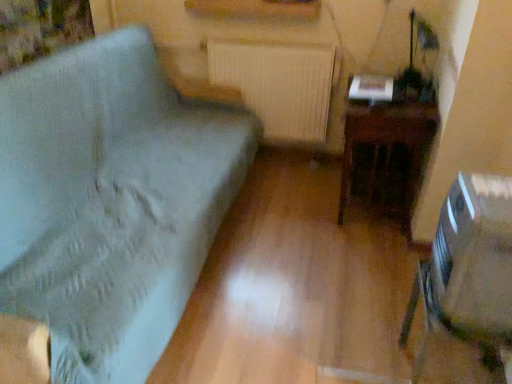
Identify the location of clear plastic swivel chair at lower right. (468, 269).

In order to face light blue fabric cushion at left, should I rotate leftwards or rightwards?

You should rotate left by 16.613 degrees.

Image resolution: width=512 pixels, height=384 pixels. Describe the element at coordinates (278, 84) in the screenshot. I see `white textured radiator at center` at that location.

You are a GUI agent. You are given a task and a screenshot of the screen. Output one action in this format:
    pyautogui.click(x=<x>, y=<y>)
    Task: Click on the clear plastic swivel chair at lower right
    
    Given the screenshot: What is the action you would take?
    pyautogui.click(x=468, y=269)

How distant is clear plastic swivel chair at lower right from light blue fabric cushion at left?

clear plastic swivel chair at lower right is 1.17 meters away from light blue fabric cushion at left.

From a real-world perspective, which is physically below, clear plastic swivel chair at lower right or light blue fabric cushion at left?

light blue fabric cushion at left, from a real-world perspective.

Is clear plastic swivel chair at lower right aimed at light blue fabric cushion at left?

Yes, clear plastic swivel chair at lower right is facing light blue fabric cushion at left.

Would you consider clear plastic swivel chair at lower right to be distant from light blue fabric cushion at left?

clear plastic swivel chair at lower right is far away from light blue fabric cushion at left.

Is white textured radiator at center positioned beyond the bounds of clear plastic swivel chair at lower right?

white textured radiator at center lies outside clear plastic swivel chair at lower right's area.

Is white textured radiator at center turned away from clear plastic swivel chair at lower right?

No, clear plastic swivel chair at lower right is not at the back of white textured radiator at center.

Where is `radiator below the clear plastic swivel chair at lower right (from a real-world perspective)`? The height and width of the screenshot is (384, 512). radiator below the clear plastic swivel chair at lower right (from a real-world perspective) is located at coordinates (278, 84).

Considering their positions, is white textured radiator at center located in front of or behind clear plastic swivel chair at lower right?

white textured radiator at center is behind clear plastic swivel chair at lower right.

Is white textured radiator at center not close to light blue fabric cushion at left?

No, white textured radiator at center is in close proximity to light blue fabric cushion at left.

Is white textured radiator at center not within light blue fabric cushion at left?

That's correct, white textured radiator at center is outside of light blue fabric cushion at left.

Looking at this image, from a real-world perspective, is white textured radiator at center located beneath light blue fabric cushion at left?

Actually, white textured radiator at center is physically above light blue fabric cushion at left in the real world.

Is white textured radiator at center positioned with its back to light blue fabric cushion at left?

No, white textured radiator at center is not facing the opposite direction of light blue fabric cushion at left.

In terms of height, does dark wood table at right look taller or shorter compared to clear plastic swivel chair at lower right?

Clearly, dark wood table at right is taller compared to clear plastic swivel chair at lower right.

Which object is positioned more to the left, dark wood table at right or clear plastic swivel chair at lower right?

Positioned to the left is clear plastic swivel chair at lower right.

Is dark wood table at right facing towards clear plastic swivel chair at lower right?

No, dark wood table at right is not oriented towards clear plastic swivel chair at lower right.

From the picture: Does dark wood table at right lie behind clear plastic swivel chair at lower right?

Yes, it is behind clear plastic swivel chair at lower right.

Considering the positions of objects light blue fabric cushion at left and clear plastic swivel chair at lower right in the image provided, who is behind, light blue fabric cushion at left or clear plastic swivel chair at lower right?

clear plastic swivel chair at lower right.

Which is closer to the camera, (x=174, y=319) or (x=495, y=253)?

Point (x=174, y=319).

Is light blue fabric cushion at left not near clear plastic swivel chair at lower right?

light blue fabric cushion at left is far away from clear plastic swivel chair at lower right.

Is light blue fabric cushion at left facing towards dark wood table at right?

Yes, light blue fabric cushion at left is aimed at dark wood table at right.

Is light blue fabric cushion at left not close to dark wood table at right?

Yes, light blue fabric cushion at left and dark wood table at right are quite far apart.

Which is more to the right, light blue fabric cushion at left or dark wood table at right?

From the viewer's perspective, dark wood table at right appears more on the right side.

Considering the relative sizes of light blue fabric cushion at left and dark wood table at right in the image provided, is light blue fabric cushion at left smaller than dark wood table at right?

No, light blue fabric cushion at left is not smaller than dark wood table at right.

Looking at the image, does clear plastic swivel chair at lower right seem bigger or smaller compared to dark wood table at right?

clear plastic swivel chair at lower right is smaller than dark wood table at right.

From the image's perspective, which is below, clear plastic swivel chair at lower right or dark wood table at right?

clear plastic swivel chair at lower right is shown below in the image.

Is point (455, 213) positioned after point (367, 188)?

No, it is in front of (367, 188).

Does clear plastic swivel chair at lower right contain dark wood table at right?

No, dark wood table at right is not inside clear plastic swivel chair at lower right.

The height and width of the screenshot is (384, 512). I want to click on furniture in front of the clear plastic swivel chair at lower right, so click(x=110, y=201).

I want to click on swivel chair to the right of white textured radiator at center, so click(x=468, y=269).

When comparing their distances from dark wood table at right, does clear plastic swivel chair at lower right or light blue fabric cushion at left seem closer?

Among the two, clear plastic swivel chair at lower right is located nearer to dark wood table at right.

Based on the photo, estimate the real-world distances between objects in this image. Which object is further from white textured radiator at center, dark wood table at right or light blue fabric cushion at left?

light blue fabric cushion at left.

When comparing their distances from light blue fabric cushion at left, does white textured radiator at center or clear plastic swivel chair at lower right seem closer?

white textured radiator at center is positioned closer to the anchor light blue fabric cushion at left.

Which object lies nearer to the anchor point clear plastic swivel chair at lower right, white textured radiator at center or dark wood table at right?

Based on the image, dark wood table at right appears to be nearer to clear plastic swivel chair at lower right.

Which object lies further to the anchor point clear plastic swivel chair at lower right, white textured radiator at center or light blue fabric cushion at left?

Based on the image, white textured radiator at center appears to be further to clear plastic swivel chair at lower right.

Which object lies further to the anchor point clear plastic swivel chair at lower right, dark wood table at right or light blue fabric cushion at left?

light blue fabric cushion at left is further to clear plastic swivel chair at lower right.

Considering their positions, is light blue fabric cushion at left positioned closer to white textured radiator at center than dark wood table at right?

Based on the image, dark wood table at right appears to be nearer to white textured radiator at center.

Which object lies nearer to the anchor point light blue fabric cushion at left, clear plastic swivel chair at lower right or dark wood table at right?

Among the two, dark wood table at right is located nearer to light blue fabric cushion at left.

This screenshot has width=512, height=384. Find the location of `swivel chair located between light blue fabric cushion at left and dark wood table at right in the left-right direction`. swivel chair located between light blue fabric cushion at left and dark wood table at right in the left-right direction is located at coordinates (468, 269).

Where is `swivel chair positioned between light blue fabric cushion at left and white textured radiator at center from near to far`? This screenshot has width=512, height=384. swivel chair positioned between light blue fabric cushion at left and white textured radiator at center from near to far is located at coordinates (468, 269).

Locate an element on the screen. The width and height of the screenshot is (512, 384). table located between light blue fabric cushion at left and white textured radiator at center in the depth direction is located at coordinates (387, 144).

Where is `table between clear plastic swivel chair at lower right and white textured radiator at center along the z-axis`? The width and height of the screenshot is (512, 384). table between clear plastic swivel chair at lower right and white textured radiator at center along the z-axis is located at coordinates (387, 144).